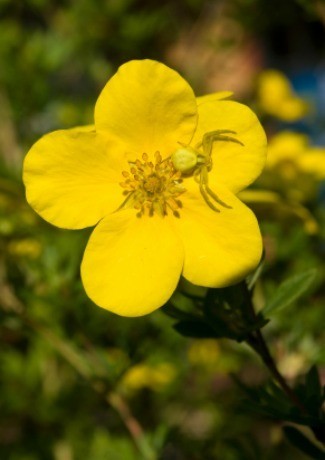
Identify the location of plant. (239, 290).